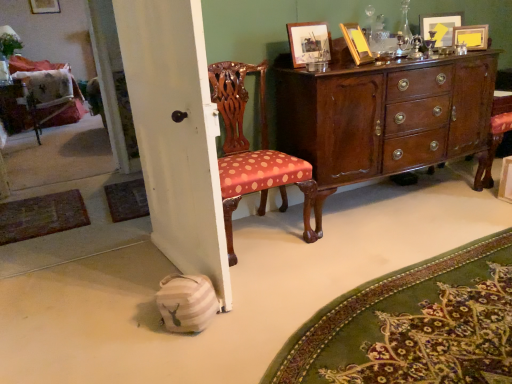
At what (x,y) coordinates should I click in order to perform the action: click on free space in front of white painted wood door at lower left. Please return your answer as a coordinate pair (x, y). This screenshot has height=384, width=512. Looking at the image, I should click on (112, 333).